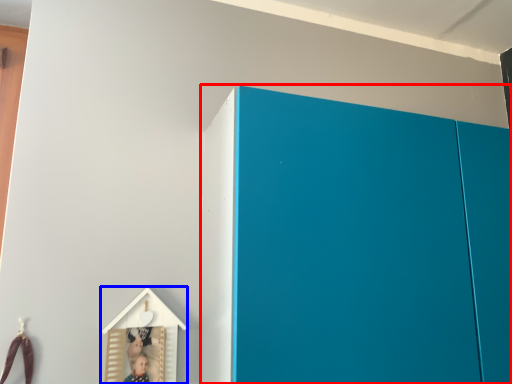
Question: Which object is further to the camera taking this photo, cupboard (highlighted by a red box) or toy (highlighted by a blue box)?

Choices:
 (A) cupboard
 (B) toy

Answer: (B)